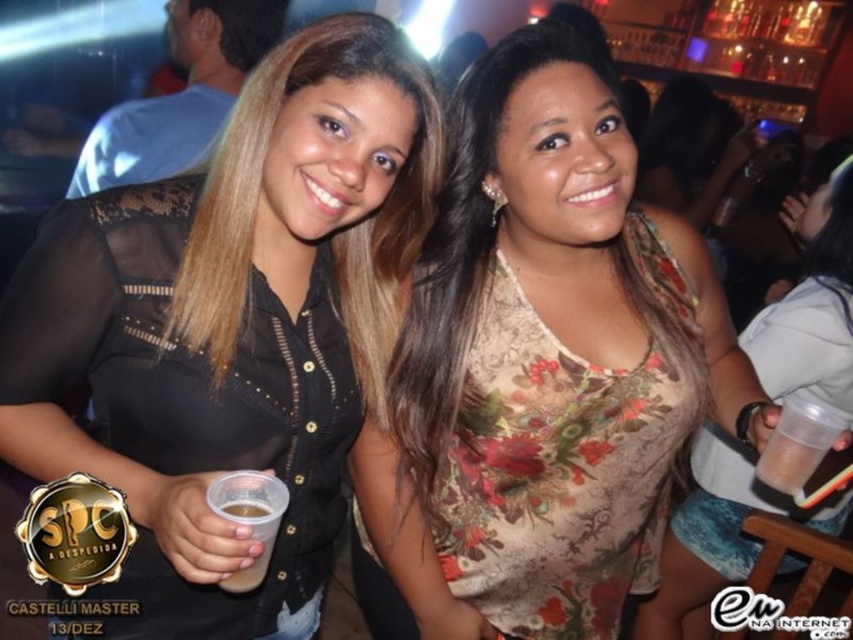
Question: Which object is the closest to the translucent plastic cup at center?

Choices:
 (A) floral-patterned top at center
 (B) black lace shirt at left

Answer: (B)

Question: Does floral-patterned top at center have a larger size compared to translucent plastic cup at center?

Choices:
 (A) yes
 (B) no

Answer: (A)

Question: Does black lace shirt at left have a smaller size compared to floral-patterned top at center?

Choices:
 (A) no
 (B) yes

Answer: (B)

Question: Which point is closer to the camera?

Choices:
 (A) (567, 547)
 (B) (233, 509)
 (C) (289, 410)
 (D) (805, 285)

Answer: (B)

Question: Can you confirm if floral-patterned top at center is smaller than floral-patterned fabric dress at center?

Choices:
 (A) yes
 (B) no

Answer: (A)

Question: Which of the following is the closest to the observer?

Choices:
 (A) (247, 577)
 (B) (299, 45)

Answer: (A)